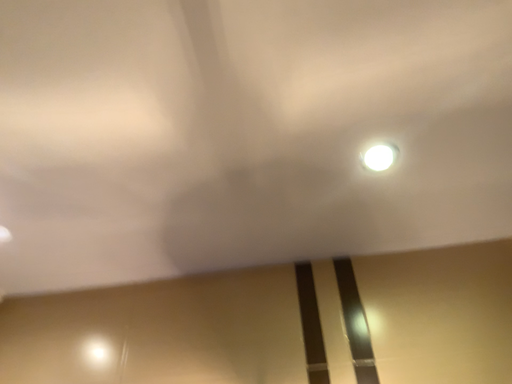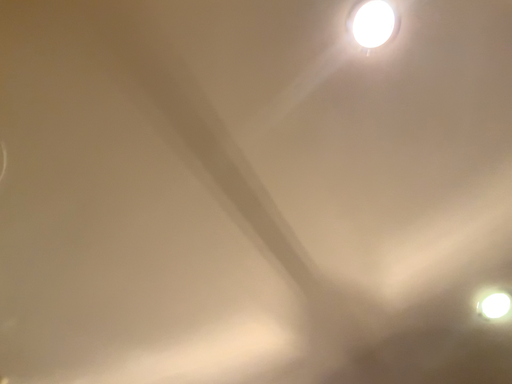
Question: How did the camera likely rotate when shooting the video?

Choices:
 (A) rotated left
 (B) rotated right

Answer: (A)